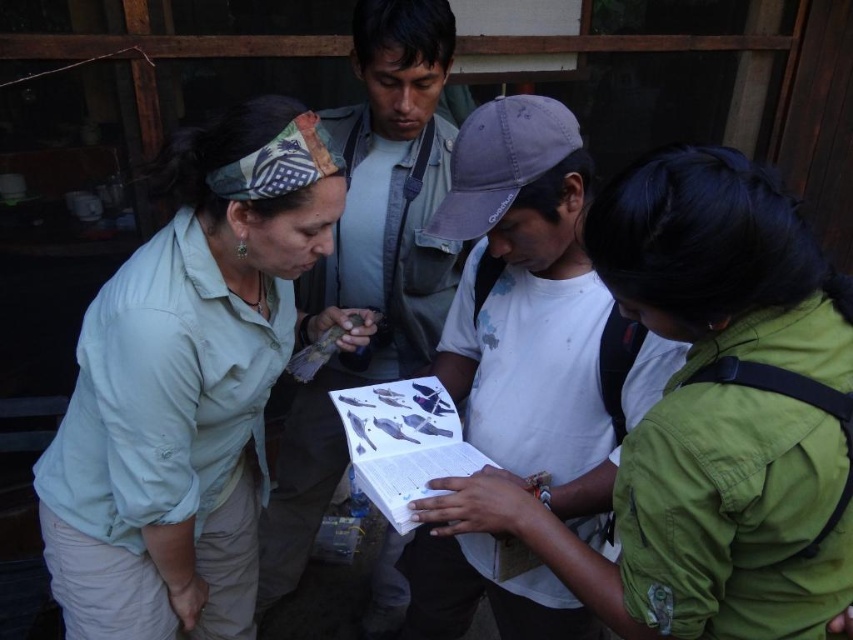
From the picture: Based on the coordinates provided, which object is located at point [708,417]?

The point [708,417] corresponds to the green matte jacket at center.

You are part of a group observing a bird being shown by the woman in the light green shirt. You need to hand a notebook to the person in the matte green shirt at center and the person in the matte gray shirt at center. Which one is closer to your current position if you are standing to the right of the woman?

The matte green shirt at center is closer to your current position since it is positioned on the left side of the matte gray shirt at center, meaning it is nearer to the right side of the frame where you are standing.